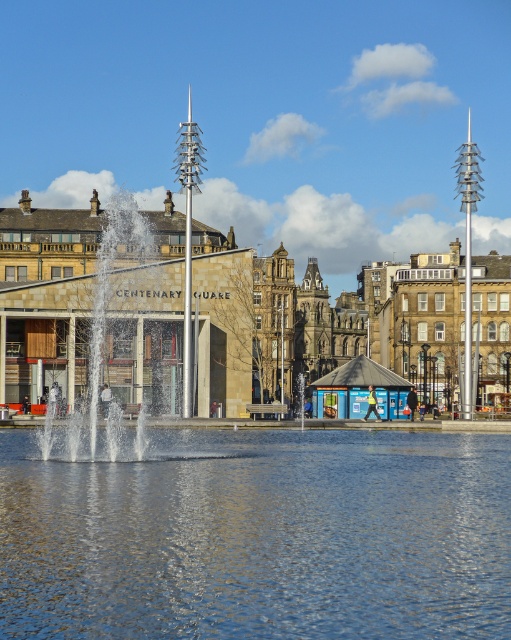
Which is behind, point (347, 477) or point (312, 333)?

The point (312, 333) is behind.

Based on the photo, can you confirm if clear water at center is thinner than polished stone fountain at center?

Answer: Indeed, clear water at center has a lesser width compared to polished stone fountain at center.

Find the location of a particular element. clear water at center is located at coordinates (260, 538).

Where is `clear water at center`? clear water at center is located at coordinates (260, 538).

Can you confirm if clear water at center is thinner than metallic fountain at center?

Incorrect, clear water at center's width is not less than metallic fountain at center's.

Is point (339, 492) farther from camera compared to point (171, 353)?

No, (339, 492) is in front of (171, 353).

You are a GUI agent. You are given a task and a screenshot of the screen. Output one action in this format:
    pyautogui.click(x=<x>, y=<y>)
    Task: Click on the clear water at center
    The image size is (511, 640).
    Given the screenshot: What is the action you would take?
    pyautogui.click(x=260, y=538)

Is polished stone fountain at center wider than metallic fountain at center?

Yes.

Which is in front, point (385, 324) or point (170, 396)?

Point (170, 396) is more forward.

Is point (429, 394) farther from camera compared to point (195, 349)?

Yes, it is.

Locate an element on the screen. Image resolution: width=511 pixels, height=640 pixels. polished stone fountain at center is located at coordinates (319, 323).